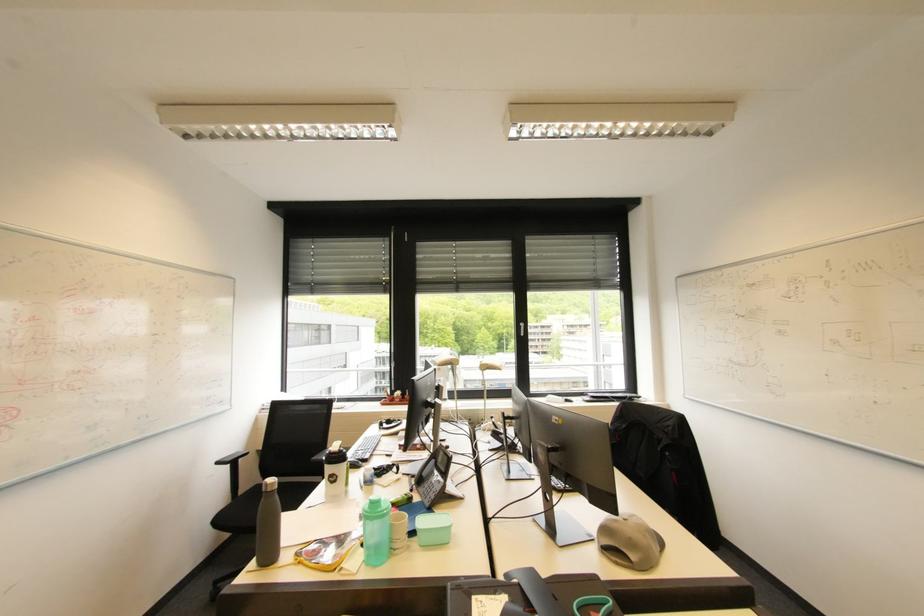
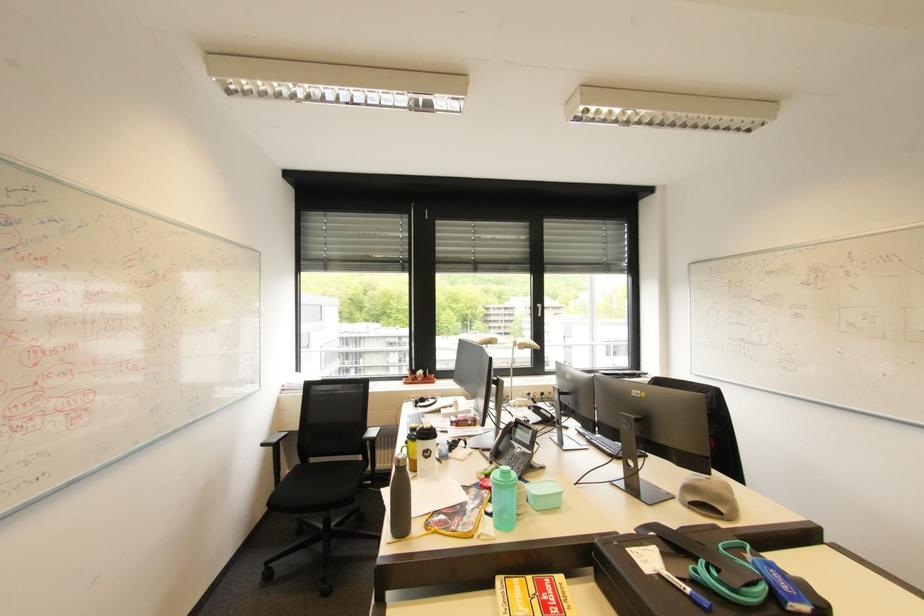
Find the pixel in the second image that matches pixel 429 476 in the first image.

(505, 448)